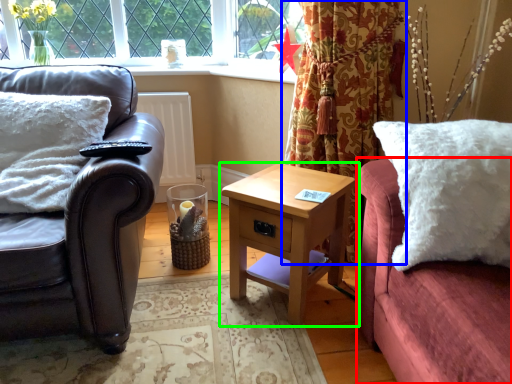
Question: Based on their relative distances, which object is nearer to couch (highlighted by a red box)? Choose from curtain (highlighted by a blue box) and nightstand (highlighted by a green box).

Choices:
 (A) curtain
 (B) nightstand

Answer: (B)